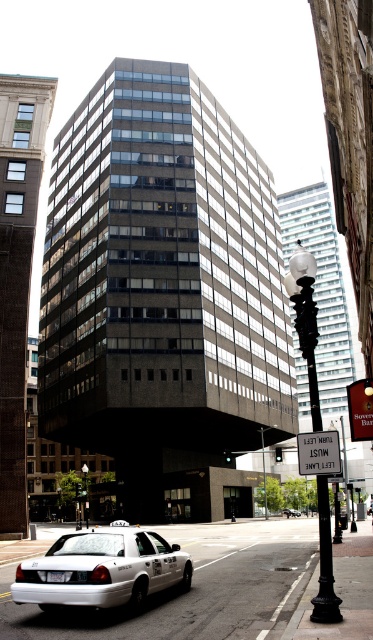
Question: Does white plastic sign at center appear over glass transparent lamp post at center?

Choices:
 (A) no
 (B) yes

Answer: (B)

Question: Is white glossy taxi at lower left above white glossy sedan at center?

Choices:
 (A) yes
 (B) no

Answer: (A)

Question: Which object is the farthest from the white glossy sedan at center?

Choices:
 (A) white plastic sign at center
 (B) glass transparent lamp post at center
 (C) black wrought iron streetlamp at center right
 (D) black glass lamp post at center

Answer: (A)

Question: Which point is closer to the camera?

Choices:
 (A) white glossy taxi at lower left
 (B) white plastic sign at center
 (C) black wrought iron streetlamp at center right
 (D) glass transparent lamp post at center

Answer: (B)

Question: Considering the relative positions of white glossy taxi at lower left and white glossy sedan at center in the image provided, where is white glossy taxi at lower left located with respect to white glossy sedan at center?

Choices:
 (A) left
 (B) right

Answer: (A)

Question: Based on their relative distances, which object is farther from the black glass lamp post at center?

Choices:
 (A) black wrought iron streetlamp at center right
 (B) white glossy taxi at lower left

Answer: (B)